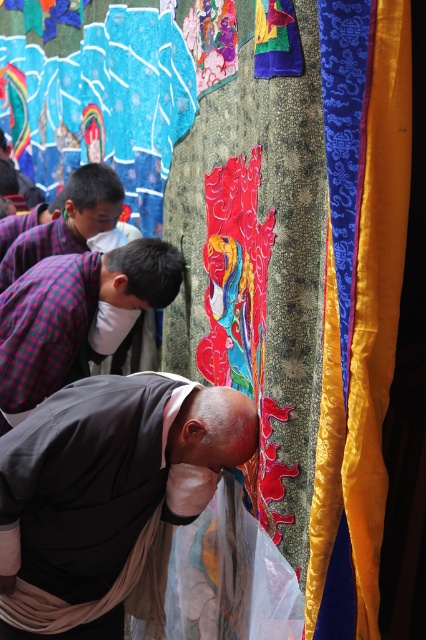
Can you confirm if gray fabric monk at center is positioned to the left of plaid fabric shirt at center?

No, gray fabric monk at center is not to the left of plaid fabric shirt at center.

Is gray fabric monk at center positioned before plaid fabric shirt at center?

That is True.

Who is more forward, (158, 548) or (28, 280)?

Point (158, 548)

This screenshot has height=640, width=426. Find the location of `gray fabric monk at center`. gray fabric monk at center is located at coordinates (108, 497).

Is gray fabric monk at center smaller than blue satin curtain at right?

No.

This screenshot has width=426, height=640. Find the location of `gray fabric monk at center`. gray fabric monk at center is located at coordinates (108, 497).

What do you see at coordinates (357, 301) in the screenshot? This screenshot has width=426, height=640. I see `blue satin curtain at right` at bounding box center [357, 301].

Who is positioned more to the left, blue satin curtain at right or plaid fabric shirt at center?

plaid fabric shirt at center

Does point (368, 468) come farther from viewer compared to point (137, 289)?

No, (368, 468) is closer to viewer.

The image size is (426, 640). What are the coordinates of `blue satin curtain at right` in the screenshot? It's located at (357, 301).